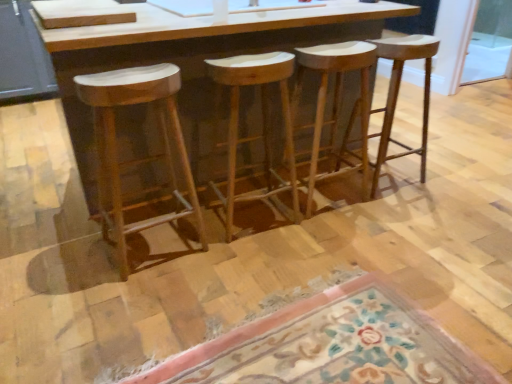
Find the location of a particular element. The width and height of the screenshot is (512, 384). free space to the left of natural wood stool at left, which is counted as the fourth stool, starting from the right is located at coordinates (69, 253).